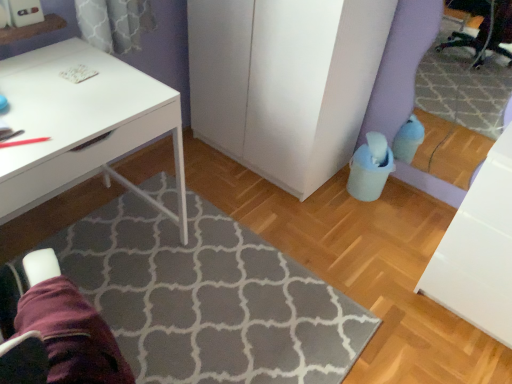
Locate an element on the screen. The image size is (512, 384). vacant space to the right of gray textured rug at center is located at coordinates (372, 268).